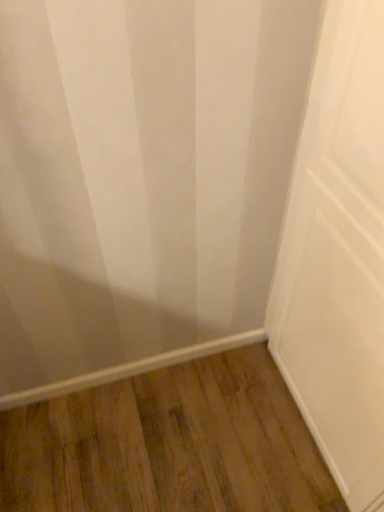
Question: Should I look upward or downward to see brown wood flooring at lower center?

Choices:
 (A) down
 (B) up

Answer: (A)

Question: Would you consider brown wood flooring at lower center to be distant from white matte door at center?

Choices:
 (A) no
 (B) yes

Answer: (A)

Question: From the image's perspective, is brown wood flooring at lower center under white matte door at center?

Choices:
 (A) no
 (B) yes

Answer: (B)

Question: Is brown wood flooring at lower center taller than white matte door at center?

Choices:
 (A) no
 (B) yes

Answer: (A)

Question: Considering the relative positions of brown wood flooring at lower center and white matte door at center in the image provided, is brown wood flooring at lower center in front of white matte door at center?

Choices:
 (A) no
 (B) yes

Answer: (A)

Question: Is brown wood flooring at lower center positioned behind white matte door at center?

Choices:
 (A) yes
 (B) no

Answer: (A)

Question: Are brown wood flooring at lower center and white matte door at center beside each other?

Choices:
 (A) yes
 (B) no

Answer: (B)

Question: Is white matte door at center facing towards brown wood flooring at lower center?

Choices:
 (A) no
 (B) yes

Answer: (B)

Question: Does white matte door at center have a lesser width compared to brown wood flooring at lower center?

Choices:
 (A) no
 (B) yes

Answer: (B)

Question: Are white matte door at center and brown wood flooring at lower center making contact?

Choices:
 (A) no
 (B) yes

Answer: (A)

Question: From a real-world perspective, is white matte door at center located beneath brown wood flooring at lower center?

Choices:
 (A) no
 (B) yes

Answer: (A)

Question: Considering the relative sizes of white matte door at center and brown wood flooring at lower center in the image provided, is white matte door at center shorter than brown wood flooring at lower center?

Choices:
 (A) yes
 (B) no

Answer: (B)

Question: Can you confirm if white matte door at center is taller than brown wood flooring at lower center?

Choices:
 (A) yes
 (B) no

Answer: (A)

Question: From their relative heights in the image, would you say brown wood flooring at lower center is taller or shorter than white matte door at center?

Choices:
 (A) tall
 (B) short

Answer: (B)